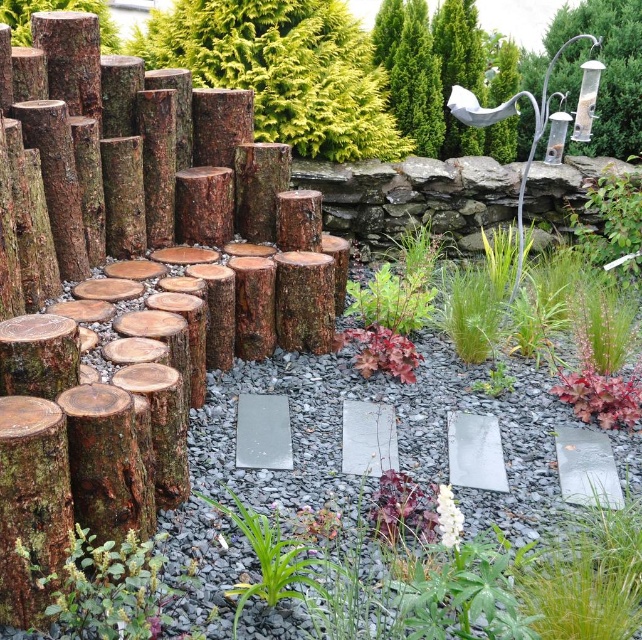
You are an artist planning to place a new sculpture in the garden. You have two options to choose from based on their thickness. The white paper at upper right and the red matte leaf at center. Which object should you choose if you want the sculpture to be thicker?

The red matte leaf at center is thicker than the white paper at upper right, so you should choose the red matte leaf at center for a thicker sculpture.

You are standing in the garden and want to pick up the white paper at upper right and the green leafy plant at center. Which object will you reach first as you move forward?

You will reach the white paper at upper right first because it is closer to you than the green leafy plant at center.

You are an artist looking to place a new sculpture in the garden. You have a white paper at upper right and a red matte leaf at center. Which object is located to the left of the other?

The white paper at upper right is positioned on the left side of red matte leaf at center.